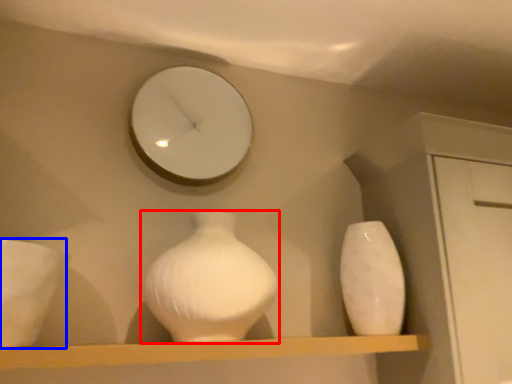
Question: Which object is further to the camera taking this photo, vase (highlighted by a red box) or porcelain (highlighted by a blue box)?

Choices:
 (A) vase
 (B) porcelain

Answer: (A)